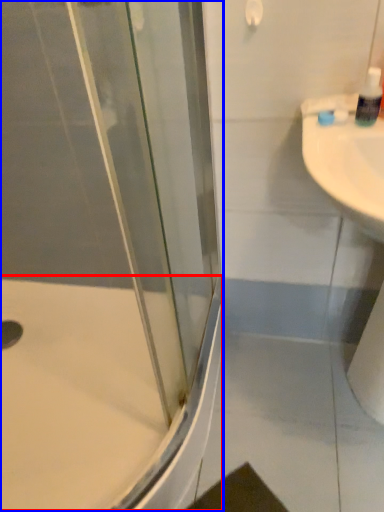
Question: Among these objects, which one is farthest to the camera, bath (highlighted by a red box) or shower door (highlighted by a blue box)?

Choices:
 (A) bath
 (B) shower door

Answer: (A)